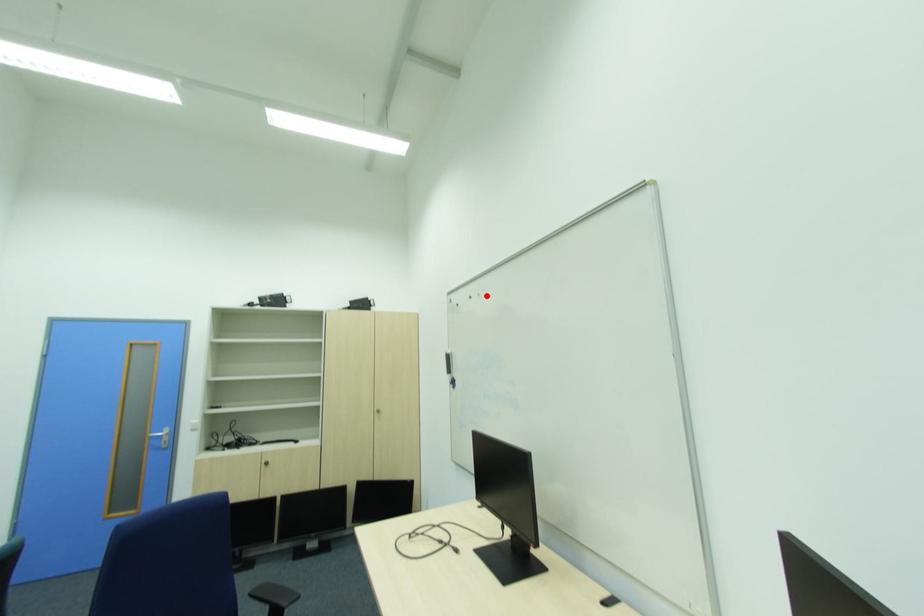
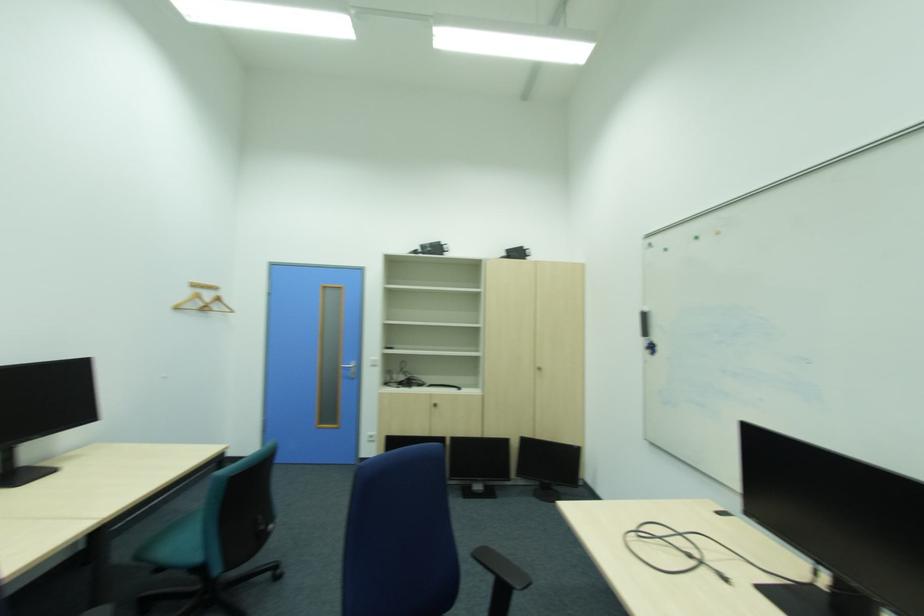
In the second image, find the point that corresponds to the highlighted location in the first image.

(725, 233)